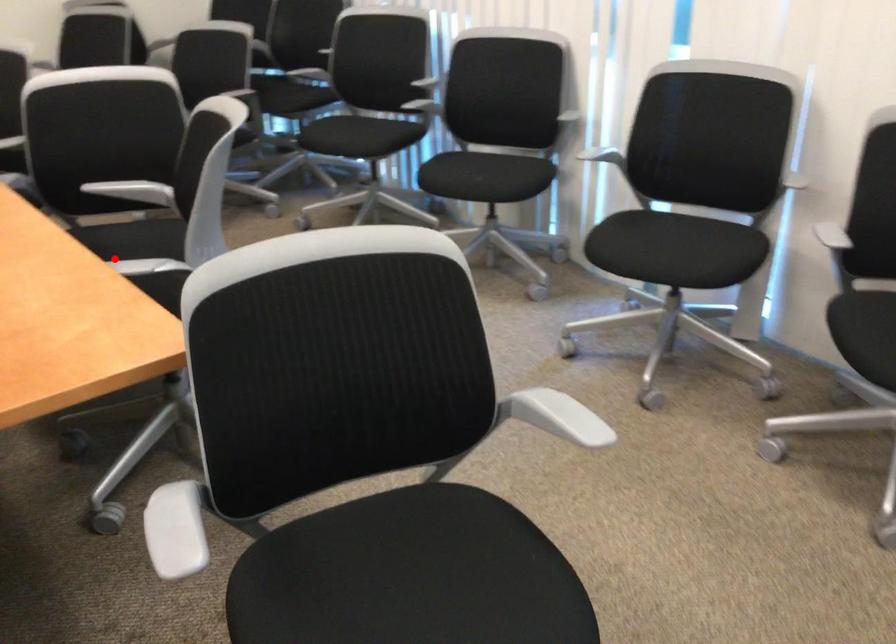
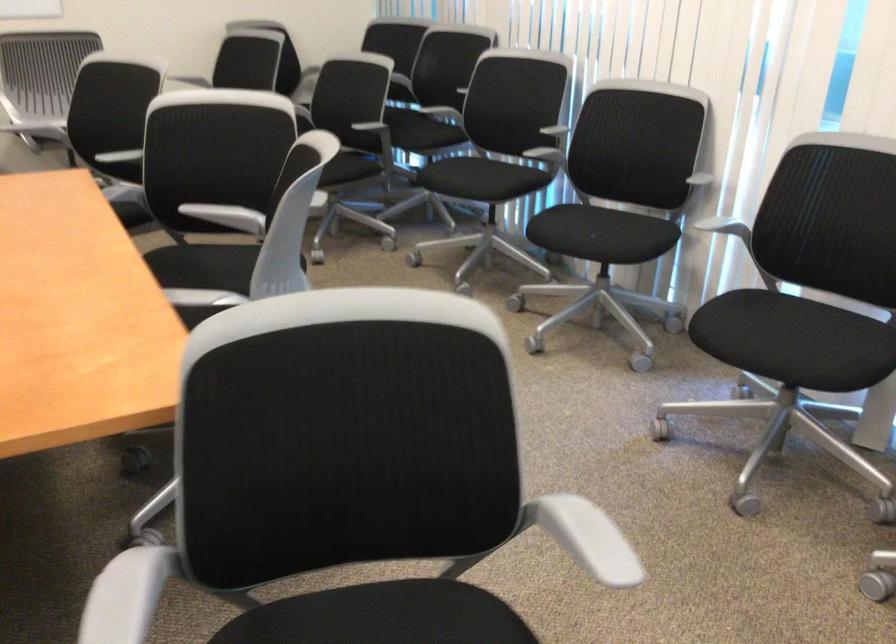
The point at the highlighted location is marked in the first image. Where is the corresponding point in the second image?

(202, 275)